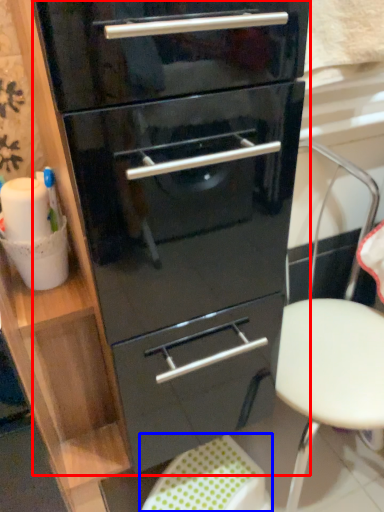
Question: Which point is closer to the camera, chest of drawers (highlighted by a red box) or step stool (highlighted by a blue box)?

Choices:
 (A) chest of drawers
 (B) step stool

Answer: (A)